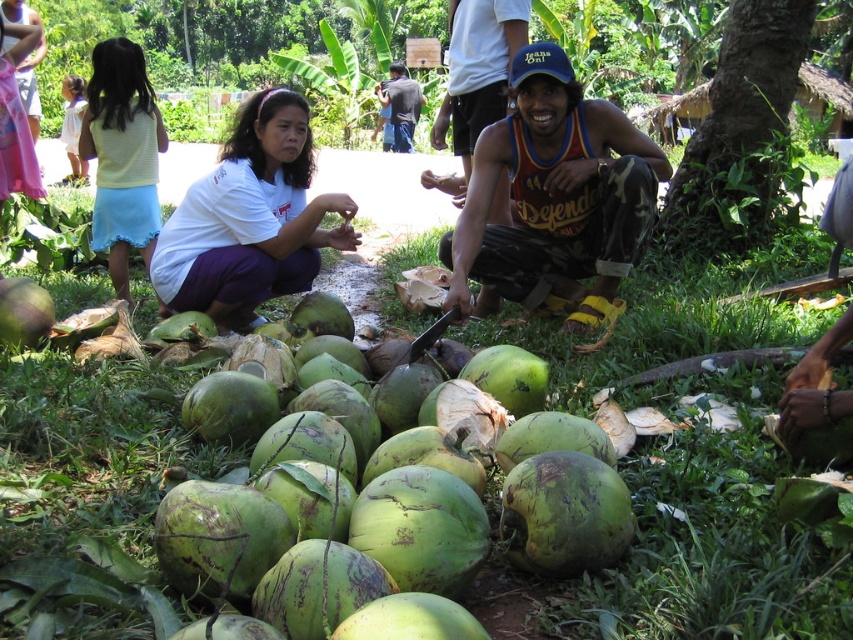
Question: Considering the relative positions of green rough coconut at center and light yellow sleeveless top at upper left in the image provided, where is green rough coconut at center located with respect to light yellow sleeveless top at upper left?

Choices:
 (A) below
 (B) above

Answer: (A)

Question: Which of these objects is positioned farthest from the white matte shirt at center?

Choices:
 (A) green rough coconut at center
 (B) camouflage pants at lower right
 (C) dark blue t-shirt at center

Answer: (C)

Question: Is green grass at center smaller than camouflage pants at lower right?

Choices:
 (A) yes
 (B) no

Answer: (B)

Question: Is the position of light yellow sleeveless top at upper left less distant than that of camouflage pants at lower right?

Choices:
 (A) yes
 (B) no

Answer: (B)

Question: Estimate the real-world distances between objects in this image. Which object is closer to the light yellow sleeveless top at upper left?

Choices:
 (A) white matte shirt at center
 (B) green rough coconut at center
 (C) dark blue t-shirt at center

Answer: (A)

Question: Which object is the closest to the light yellow sleeveless top at upper left?

Choices:
 (A) white matte shirt at center
 (B) camouflage pants at center
 (C) green grass at center

Answer: (A)